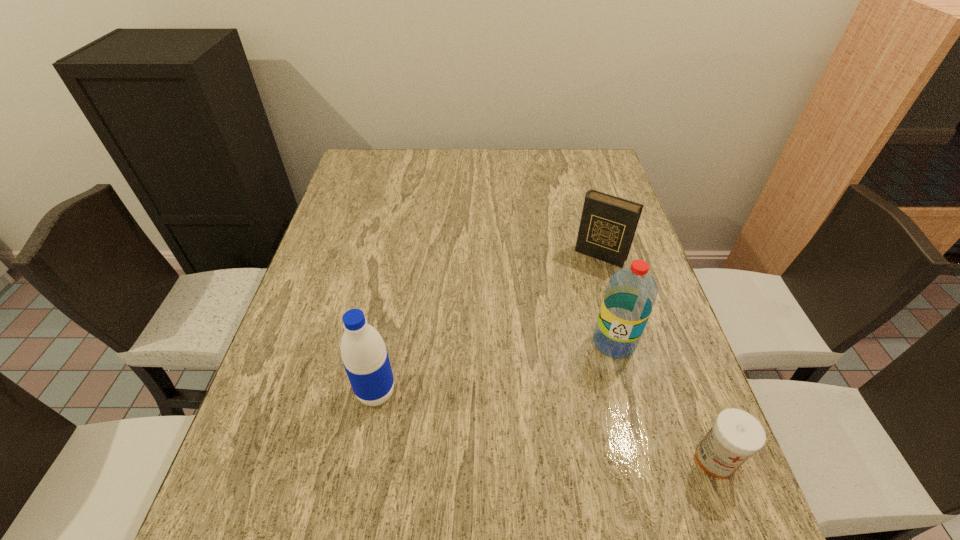
I want to click on free space on the desktop that is between the nearer water bottle and the medicine and is positioned on the front label of the second farthest object, so click(x=569, y=431).

The width and height of the screenshot is (960, 540). I want to click on vacant spot on the desktop that is between the left water bottle and the shortest object and is positioned on the front cover of the second shortest object, so click(x=505, y=418).